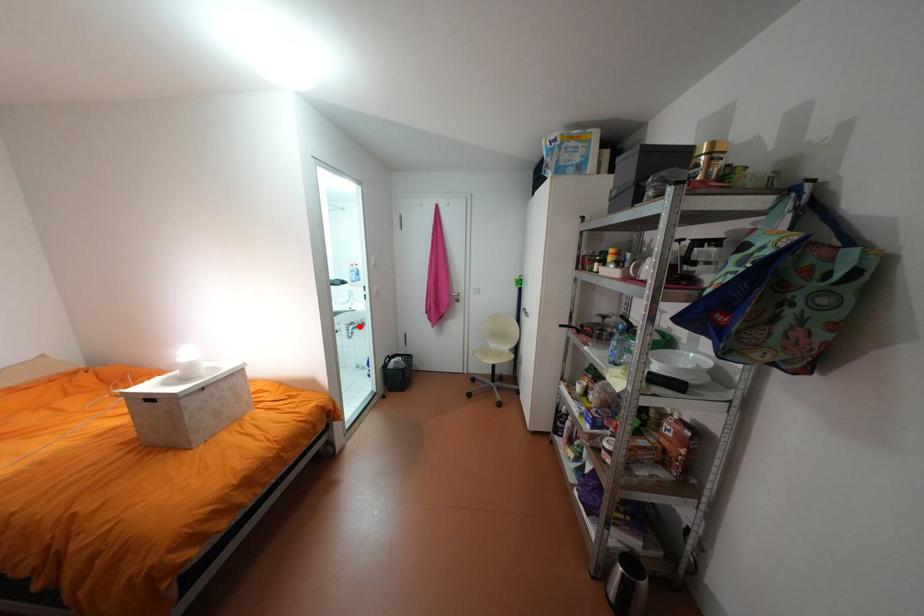
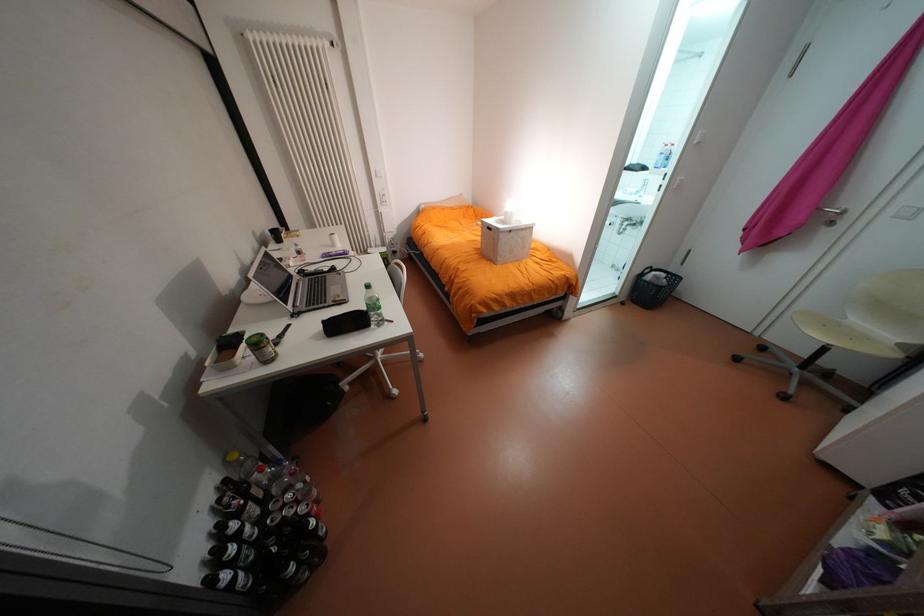
Question: A red point is marked in image1. In image2, is the corresponding 3D point closer to the camera or farther? Reply with the corresponding letter.

Choices:
 (A) The corresponding 3D point is closer.
 (B) The corresponding 3D point is farther.

Answer: (A)